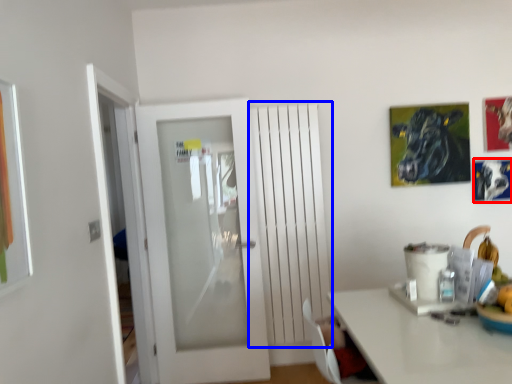
Question: Which object is further to the camera taking this photo, picture frame (highlighted by a red box) or radiator (highlighted by a blue box)?

Choices:
 (A) picture frame
 (B) radiator

Answer: (A)